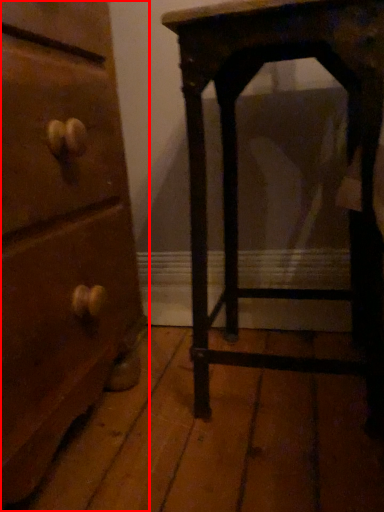
Question: From the image, what is the correct spatial relationship of chest of drawers (annotated by the red box) in relation to furniture?

Choices:
 (A) right
 (B) left

Answer: (B)